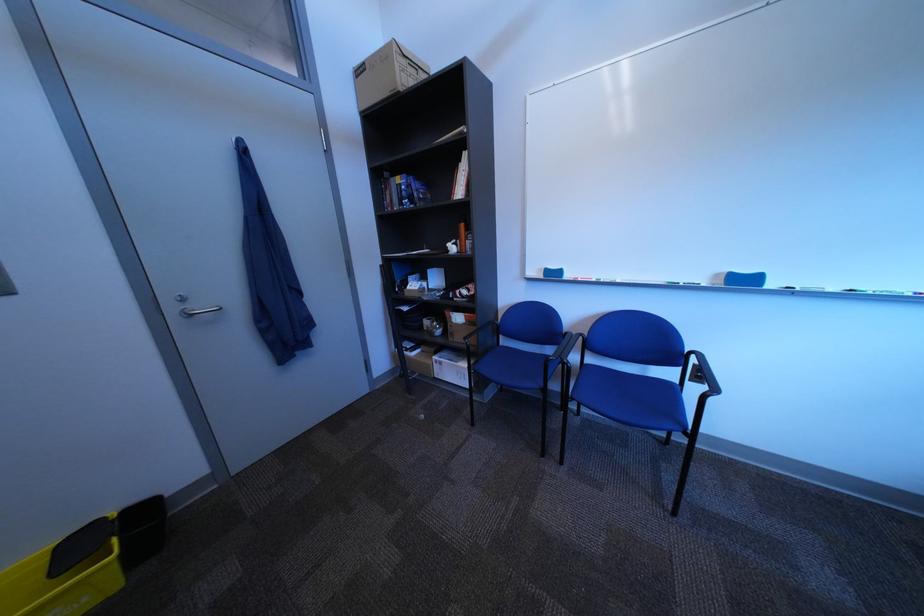
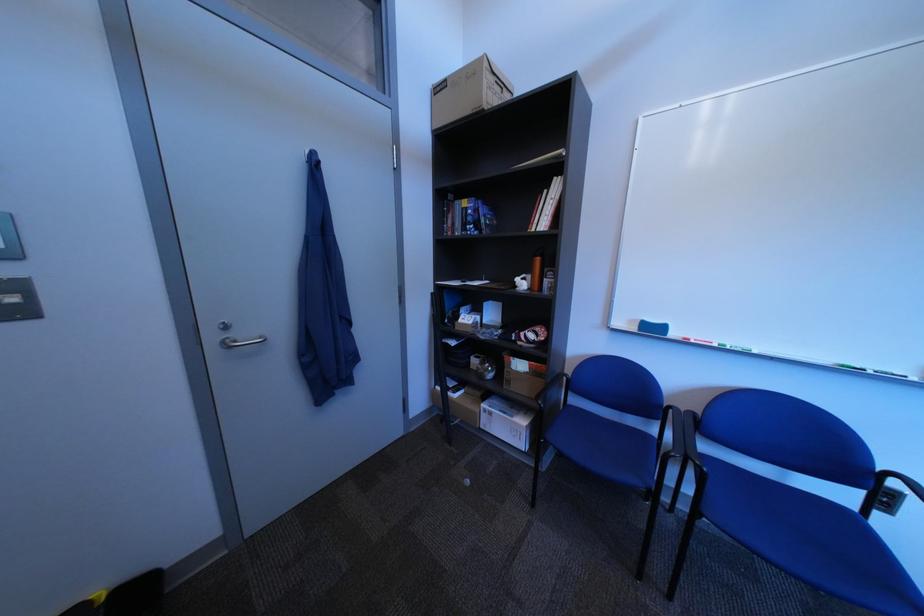
In the second image, find the point that corresponds to [490,373] in the first image.

(561, 442)